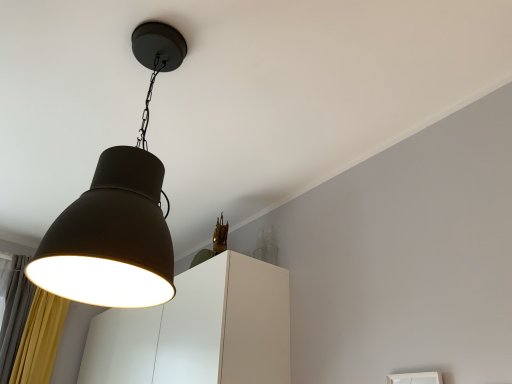
Question: Should I look upward or downward to see matte black lampshade at upper left?

Choices:
 (A) up
 (B) down

Answer: (A)

Question: Does white matte cabinet at center lie behind matte black lampshade at upper left?

Choices:
 (A) yes
 (B) no

Answer: (A)

Question: Would you say matte black lampshade at upper left is part of white matte cabinet at center's contents?

Choices:
 (A) no
 (B) yes

Answer: (A)

Question: Does white matte cabinet at center have a greater width compared to matte black lampshade at upper left?

Choices:
 (A) yes
 (B) no

Answer: (A)

Question: Is white matte cabinet at center to the left of matte black lampshade at upper left from the viewer's perspective?

Choices:
 (A) no
 (B) yes

Answer: (B)

Question: Is the depth of white matte cabinet at center less than that of matte black lampshade at upper left?

Choices:
 (A) yes
 (B) no

Answer: (B)

Question: Is white matte cabinet at center at the right side of matte black lampshade at upper left?

Choices:
 (A) no
 (B) yes

Answer: (A)

Question: Can you confirm if matte black lampshade at upper left is wider than white matte cabinet at center?

Choices:
 (A) no
 (B) yes

Answer: (A)

Question: Can you confirm if matte black lampshade at upper left is smaller than white matte cabinet at center?

Choices:
 (A) no
 (B) yes

Answer: (B)

Question: From a real-world perspective, is matte black lampshade at upper left positioned over white matte cabinet at center based on gravity?

Choices:
 (A) yes
 (B) no

Answer: (A)

Question: Is matte black lampshade at upper left oriented towards white matte cabinet at center?

Choices:
 (A) no
 (B) yes

Answer: (A)

Question: From a real-world perspective, is matte black lampshade at upper left physically below white matte cabinet at center?

Choices:
 (A) no
 (B) yes

Answer: (A)

Question: Is matte black lampshade at upper left at the left side of white matte cabinet at center?

Choices:
 (A) no
 (B) yes

Answer: (A)

Question: From the image's perspective, is matte black lampshade at upper left positioned above or below white matte cabinet at center?

Choices:
 (A) above
 (B) below

Answer: (A)